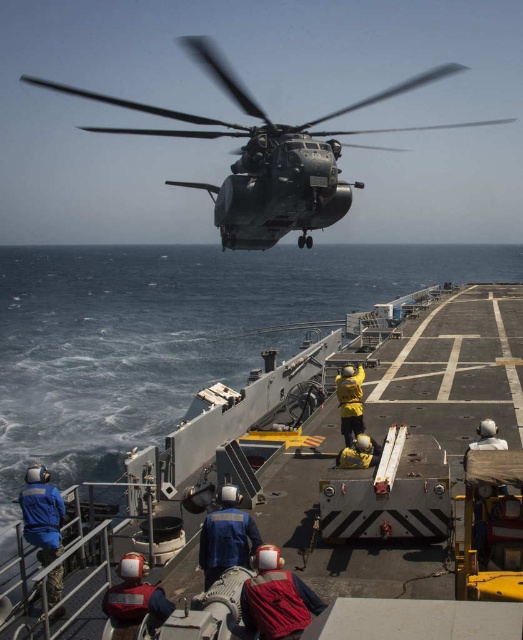
Measure the distance between point (x=53, y=488) and camera.

They are 22.90 feet apart.

Is blue fabric sailor at lower left thinner than yellow matte helmet at center?

Incorrect, blue fabric sailor at lower left's width is not less than yellow matte helmet at center's.

Where is `blue fabric sailor at lower left`? blue fabric sailor at lower left is located at coordinates (41, 513).

Can you confirm if red reflective vest at lower center is thinner than blue fabric sailor at center?

In fact, red reflective vest at lower center might be wider than blue fabric sailor at center.

Consider the image. Does red reflective vest at lower center have a lesser height compared to blue fabric sailor at center?

Indeed, red reflective vest at lower center has a lesser height compared to blue fabric sailor at center.

What do you see at coordinates (277, 598) in the screenshot? Image resolution: width=523 pixels, height=640 pixels. I see `red reflective vest at lower center` at bounding box center [277, 598].

Locate an element on the screen. red reflective vest at lower center is located at coordinates pyautogui.click(x=277, y=598).

Consider the image. Who is shorter, blue fabric sailor at lower left or blue fabric sailor at center?

blue fabric sailor at center

Can you confirm if blue fabric sailor at lower left is wider than blue fabric sailor at center?

Indeed, blue fabric sailor at lower left has a greater width compared to blue fabric sailor at center.

At what (x,y) coordinates should I click in order to perform the action: click on blue fabric sailor at lower left. Please return your answer as a coordinate pair (x, y). This screenshot has height=640, width=523. Looking at the image, I should click on (41, 513).